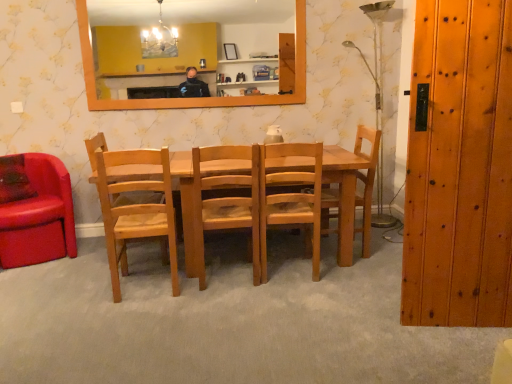
Locate an element on the screen. The height and width of the screenshot is (384, 512). light brown wood chair at center, marked as the 4th chair in a left-to-right arrangement is located at coordinates (291, 198).

How much space does light brown wood chair at center, marked as the 4th chair in a left-to-right arrangement, occupy horizontally?

light brown wood chair at center, marked as the 4th chair in a left-to-right arrangement, is 17.78 inches wide.

The height and width of the screenshot is (384, 512). Describe the element at coordinates (226, 202) in the screenshot. I see `wooden chair at center, the third chair in the left-to-right sequence` at that location.

The height and width of the screenshot is (384, 512). What are the coordinates of `wooden door at right` in the screenshot? It's located at (459, 167).

The width and height of the screenshot is (512, 384). Describe the element at coordinates (366, 181) in the screenshot. I see `wooden chair at center, the first chair viewed from the right` at that location.

This screenshot has width=512, height=384. I want to click on wooden chair at center, the first chair viewed from the right, so click(366, 181).

What do you see at coordinates (136, 211) in the screenshot?
I see `natural wood chair at left, which is the 4th chair in right-to-left order` at bounding box center [136, 211].

This screenshot has height=384, width=512. What are the coordinates of `light brown wood chair at center, which appears as the second chair when viewed from the right` in the screenshot? It's located at (291, 198).

Consider the image. Could you tell me if leather couch at left, acting as the first chair starting from the left, is facing wooden chair at center, the third chair in the left-to-right sequence?

No, leather couch at left, acting as the first chair starting from the left, is not turned towards wooden chair at center, the third chair in the left-to-right sequence.

Does leather couch at left, acting as the first chair starting from the left, have a lesser height compared to wooden chair at center, the third chair in the left-to-right sequence?

Indeed, leather couch at left, acting as the first chair starting from the left, has a lesser height compared to wooden chair at center, the third chair in the left-to-right sequence.

Based on the photo, can you confirm if leather couch at left, which ranks as the 5th chair in right-to-left order, is thinner than wooden chair at center, the third chair from the right?

No, leather couch at left, which ranks as the 5th chair in right-to-left order, is not thinner than wooden chair at center, the third chair from the right.

Based on the photo, how many degrees apart are the facing directions of wooden chair at center, positioned as the fifth chair in left-to-right order, and wooden chair at center, the third chair in the left-to-right sequence?

There is a 88.5-degree angle between the facing directions of wooden chair at center, positioned as the fifth chair in left-to-right order, and wooden chair at center, the third chair in the left-to-right sequence.

Which object is wider, wooden chair at center, positioned as the fifth chair in left-to-right order, or wooden chair at center, the third chair in the left-to-right sequence?

With larger width is wooden chair at center, the third chair in the left-to-right sequence.

Who is bigger, wooden chair at center, the first chair viewed from the right, or wooden chair at center, the third chair in the left-to-right sequence?

wooden chair at center, the third chair in the left-to-right sequence.

Does wooden chair at center, the first chair viewed from the right, turn towards wooden chair at center, the third chair from the right?

Yes, wooden chair at center, the first chair viewed from the right, is turned towards wooden chair at center, the third chair from the right.

In order to click on the 2nd chair above when counting from the natural wood chair at left, the 2th chair from the left (from the image's perspective) in this screenshot , I will do `click(35, 210)`.

Consider the image. Considering the sizes of objects leather couch at left, which ranks as the 5th chair in right-to-left order, and natural wood chair at left, which is the 4th chair in right-to-left order, in the image provided, who is smaller, leather couch at left, which ranks as the 5th chair in right-to-left order, or natural wood chair at left, which is the 4th chair in right-to-left order,?

With smaller size is natural wood chair at left, which is the 4th chair in right-to-left order.

From the image's perspective, is leather couch at left, acting as the first chair starting from the left, above natural wood chair at left, the 2th chair from the left?

Indeed, from the image's perspective, leather couch at left, acting as the first chair starting from the left, is shown above natural wood chair at left, the 2th chair from the left.

Is leather couch at left, which ranks as the 5th chair in right-to-left order, inside or outside of natural wood chair at left, the 2th chair from the left?

leather couch at left, which ranks as the 5th chair in right-to-left order, is not inside natural wood chair at left, the 2th chair from the left, it's outside.

Which is closer to the camera, (201, 255) or (326, 225)?

The point (201, 255) is more forward.

Between wooden chair at center, the third chair from the right, and wooden chair at center, the first chair viewed from the right, which one has more height?

With more height is wooden chair at center, the first chair viewed from the right.

Are wooden chair at center, the third chair in the left-to-right sequence, and wooden chair at center, positioned as the fifth chair in left-to-right order, far apart?

No, wooden chair at center, the third chair in the left-to-right sequence, is not far from wooden chair at center, positioned as the fifth chair in left-to-right order.

Considering the positions of objects wooden door at right and wooden chair at center, the third chair in the left-to-right sequence, in the image provided, who is more to the right, wooden door at right or wooden chair at center, the third chair in the left-to-right sequence,?

wooden door at right.

From the image's perspective, which is above, wooden door at right or wooden chair at center, the third chair in the left-to-right sequence?

wooden door at right.

Is wooden door at right not inside wooden chair at center, the third chair in the left-to-right sequence?

Yes, wooden door at right is not within wooden chair at center, the third chair in the left-to-right sequence.

Consider the image. From a real-world perspective, relative to wooden chair at center, the third chair from the right, is wooden door at right vertically above or below?

Clearly, from a real-world perspective, wooden door at right is above wooden chair at center, the third chair from the right.

From a real-world perspective, does wooden chair at center, the third chair in the left-to-right sequence, stand above natural wood chair at left, which is the 4th chair in right-to-left order?

No, from a real-world perspective, wooden chair at center, the third chair in the left-to-right sequence, is not above natural wood chair at left, which is the 4th chair in right-to-left order.

In terms of width, does wooden chair at center, the third chair from the right, look wider or thinner when compared to natural wood chair at left, the 2th chair from the left?

Considering their sizes, wooden chair at center, the third chair from the right, looks broader than natural wood chair at left, the 2th chair from the left.

At what (x,y) coordinates should I click in order to perform the action: click on chair that is the 2nd object above the wooden chair at center, the third chair from the right (from a real-world perspective). Please return your answer as a coordinate pair (x, y). This screenshot has width=512, height=384. Looking at the image, I should click on (136, 211).

Is wooden chair at center, the third chair from the right, touching natural wood chair at left, the 2th chair from the left?

No.

Is light brown wood chair at center, marked as the 4th chair in a left-to-right arrangement, far away from leather couch at left, acting as the first chair starting from the left?

Yes, light brown wood chair at center, marked as the 4th chair in a left-to-right arrangement, and leather couch at left, acting as the first chair starting from the left, are located far from each other.

Is light brown wood chair at center, which appears as the second chair when viewed from the right, completely or partially outside of leather couch at left, which ranks as the 5th chair in right-to-left order?

Indeed, light brown wood chair at center, which appears as the second chair when viewed from the right, is completely outside leather couch at left, which ranks as the 5th chair in right-to-left order.

Does point (271, 181) come farther from viewer compared to point (14, 161)?

No.

From a real-world perspective, is light brown wood chair at center, which appears as the second chair when viewed from the right, positioned above or below leather couch at left, which ranks as the 5th chair in right-to-left order?

Clearly, from a real-world perspective, light brown wood chair at center, which appears as the second chair when viewed from the right, is above leather couch at left, which ranks as the 5th chair in right-to-left order.

This screenshot has width=512, height=384. I want to click on the 1st chair directly above the leather couch at left, acting as the first chair starting from the left (from a real-world perspective), so click(x=226, y=202).

The image size is (512, 384). Identify the location of the 3rd chair above the wooden chair at center, the third chair from the right (from the image's perspective). (366, 181).

Based on their spatial positions, is wooden door at right or orange wooden mirror at upper center further from leather couch at left, which ranks as the 5th chair in right-to-left order?

wooden door at right.

Based on their spatial positions, is orange wooden mirror at upper center or leather couch at left, acting as the first chair starting from the left, further from light brown wood chair at center, marked as the 4th chair in a left-to-right arrangement?

The object further to light brown wood chair at center, marked as the 4th chair in a left-to-right arrangement, is orange wooden mirror at upper center.

Which object lies nearer to the anchor point natural wood chair at left, which is the 4th chair in right-to-left order, wooden door at right or orange wooden mirror at upper center?

Among the two, wooden door at right is located nearer to natural wood chair at left, which is the 4th chair in right-to-left order.

Estimate the real-world distances between objects in this image. Which object is further from light brown wood chair at center, marked as the 4th chair in a left-to-right arrangement, wooden chair at center, positioned as the fifth chair in left-to-right order, or leather couch at left, acting as the first chair starting from the left?

leather couch at left, acting as the first chair starting from the left.

Which object lies nearer to the anchor point wooden chair at center, the third chair in the left-to-right sequence, wooden door at right or natural wood chair at left, the 2th chair from the left?

natural wood chair at left, the 2th chair from the left, is positioned closer to the anchor wooden chair at center, the third chair in the left-to-right sequence.

When comparing their distances from wooden chair at center, the first chair viewed from the right, does wooden door at right or natural wood chair at left, the 2th chair from the left, seem closer?

Among the two, wooden door at right is located nearer to wooden chair at center, the first chair viewed from the right.

Based on their spatial positions, is light brown wood chair at center, which appears as the second chair when viewed from the right, or natural wood chair at left, which is the 4th chair in right-to-left order, further from leather couch at left, acting as the first chair starting from the left?

Based on the image, light brown wood chair at center, which appears as the second chair when viewed from the right, appears to be further to leather couch at left, acting as the first chair starting from the left.

When comparing their distances from wooden door at right, does leather couch at left, acting as the first chair starting from the left, or orange wooden mirror at upper center seem closer?

leather couch at left, acting as the first chair starting from the left, is positioned closer to the anchor wooden door at right.

The image size is (512, 384). Identify the location of chair between orange wooden mirror at upper center and light brown wood chair at center, which appears as the second chair when viewed from the right, vertically. (366, 181).

In order to click on mirror between leather couch at left, acting as the first chair starting from the left, and light brown wood chair at center, marked as the 4th chair in a left-to-right arrangement, from left to right in this screenshot , I will do `click(181, 35)`.

Identify the location of mirror between leather couch at left, acting as the first chair starting from the left, and wooden chair at center, the third chair from the right, from left to right. (181, 35).

The width and height of the screenshot is (512, 384). Identify the location of mirror between natural wood chair at left, which is the 4th chair in right-to-left order, and wooden door at right, in the horizontal direction. (181, 35).